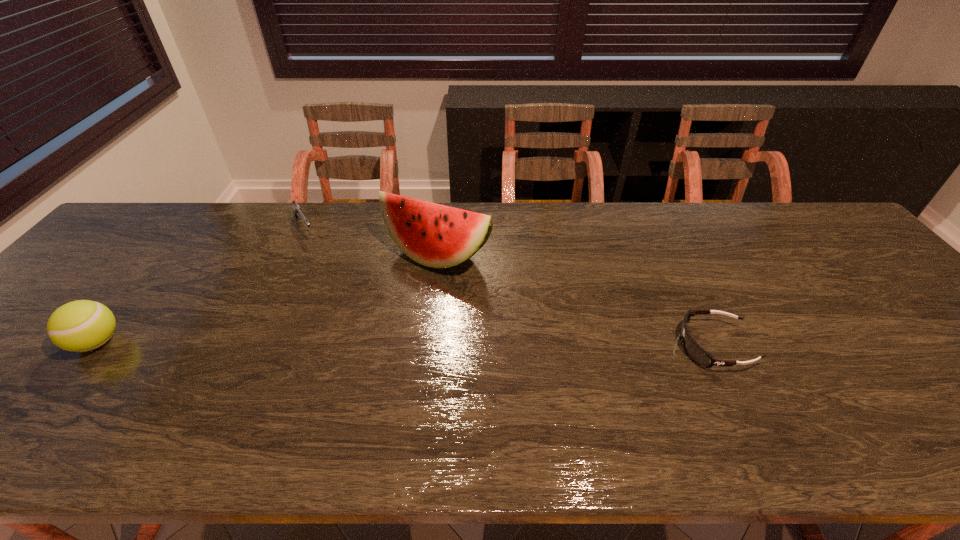
Identify the location of vacant point located between the goggles and the second object from left to right. (509, 287).

Locate an element on the screen. empty location between the goggles and the second shortest object is located at coordinates (509, 287).

The height and width of the screenshot is (540, 960). In order to click on free space between the goggles and the second object from right to left in this screenshot , I will do `click(575, 301)`.

I want to click on vacant area between the second object from left to right and the tallest object, so click(x=371, y=242).

Identify the location of empty location between the second shortest object and the second tallest object. This screenshot has height=540, width=960. tap(201, 285).

Choose which object is the third nearest neighbor to the leftmost object. Please provide its 2D coordinates. Your answer should be formatted as a tuple, i.e. [(x, y)], where the tuple contains the x and y coordinates of a point satisfying the conditions above.

[(692, 348)]

Choose which object is the nearest neighbor to the second tallest object. Please provide its 2D coordinates. Your answer should be formatted as a tuple, i.e. [(x, y)], where the tuple contains the x and y coordinates of a point satisfying the conditions above.

[(297, 210)]

Where is `vacant point that satisfies the following two spatial constraints: 1. on the front side of the third tallest object; 2. on the front and sides of the rightmost object`? The image size is (960, 540). vacant point that satisfies the following two spatial constraints: 1. on the front side of the third tallest object; 2. on the front and sides of the rightmost object is located at coordinates (248, 346).

You are a GUI agent. You are given a task and a screenshot of the screen. Output one action in this format:
    pyautogui.click(x=<x>, y=<y>)
    Task: Click on the vacant area that satisfies the following two spatial constraints: 1. on the back side of the watermelon; 2. on the right side of the leftmost object
    Image resolution: width=960 pixels, height=540 pixels.
    Given the screenshot: What is the action you would take?
    pyautogui.click(x=167, y=255)

Identify the location of free space that satisfies the following two spatial constraints: 1. on the front side of the third object from left to right; 2. on the front and sides of the rightmost object. (426, 346).